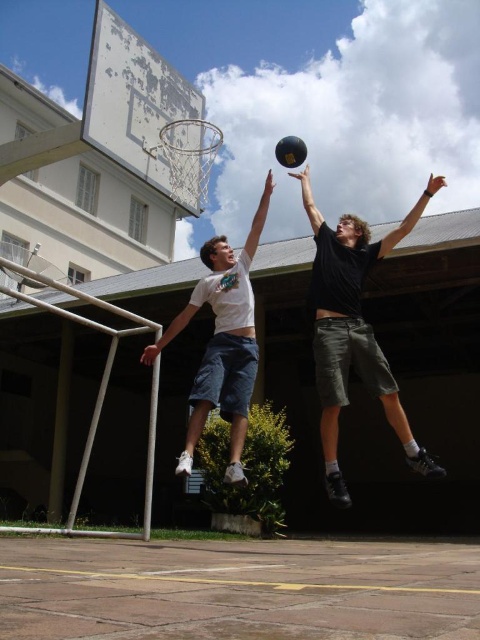
Question: Does white matte shorts at center lie behind silver metallic basketball hoop at upper center?

Choices:
 (A) no
 (B) yes

Answer: (A)

Question: Is black matte basketball at center to the left of silver metallic basketball hoop at upper center from the viewer's perspective?

Choices:
 (A) no
 (B) yes

Answer: (A)

Question: Among these points, which one is farthest from the camera?

Choices:
 (A) (362, 364)
 (B) (216, 388)
 (C) (206, 147)

Answer: (C)

Question: Can you confirm if black matte basketball at center is smaller than white matte shorts at center?

Choices:
 (A) no
 (B) yes

Answer: (A)

Question: Which of the following is the closest to the observer?

Choices:
 (A) white matte shorts at center
 (B) black matte basketball at center

Answer: (B)

Question: Which of the following is the closest to the observer?

Choices:
 (A) silver metallic basketball hoop at upper center
 (B) black matte basketball at center

Answer: (B)